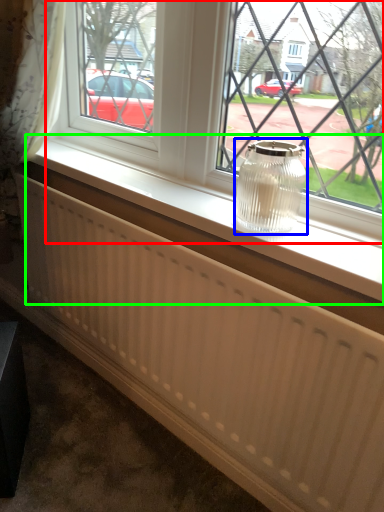
Question: Which is nearer to the window (highlighted by a red box)? glass vase (highlighted by a blue box) or window sill (highlighted by a green box).

Choices:
 (A) glass vase
 (B) window sill

Answer: (B)